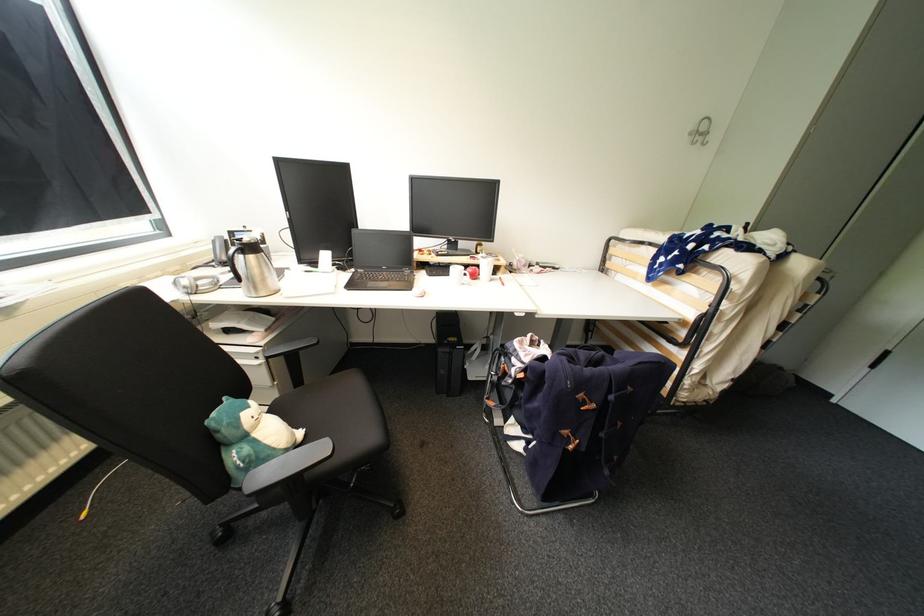
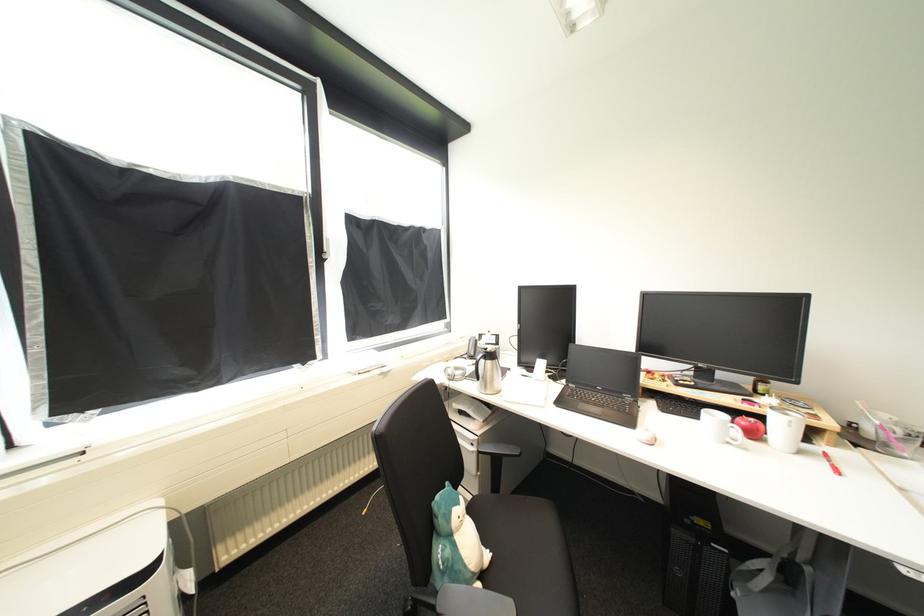
Question: The images are taken continuously from a first-person perspective. In which direction is your viewpoint rotating?

Choices:
 (A) Left
 (B) Right
 (C) Up
 (D) Down

Answer: (A)